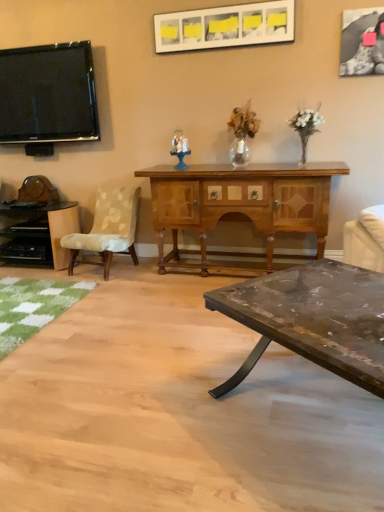
Locate an element on the screen. This screenshot has width=384, height=512. free point to the left of rustic wood coffee table at lower right is located at coordinates (170, 423).